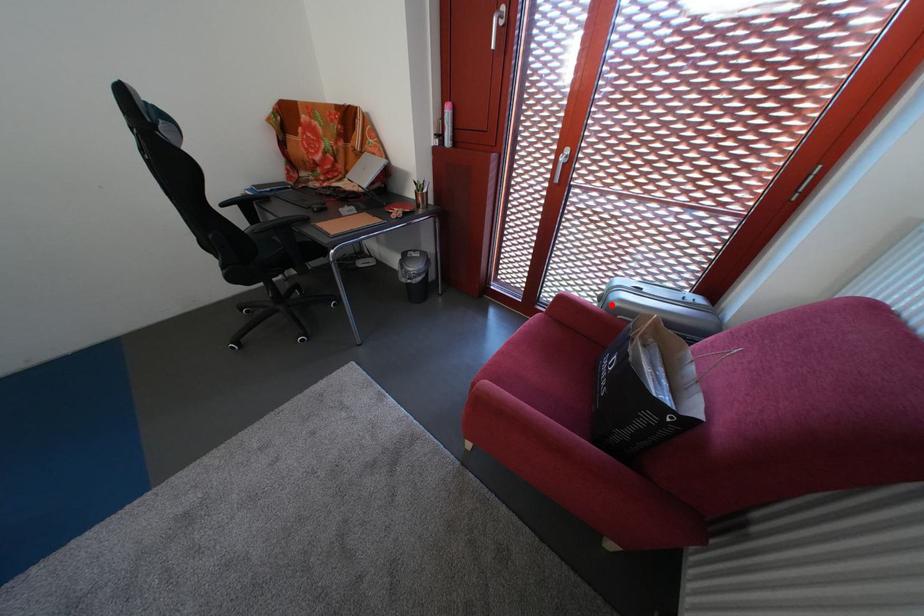
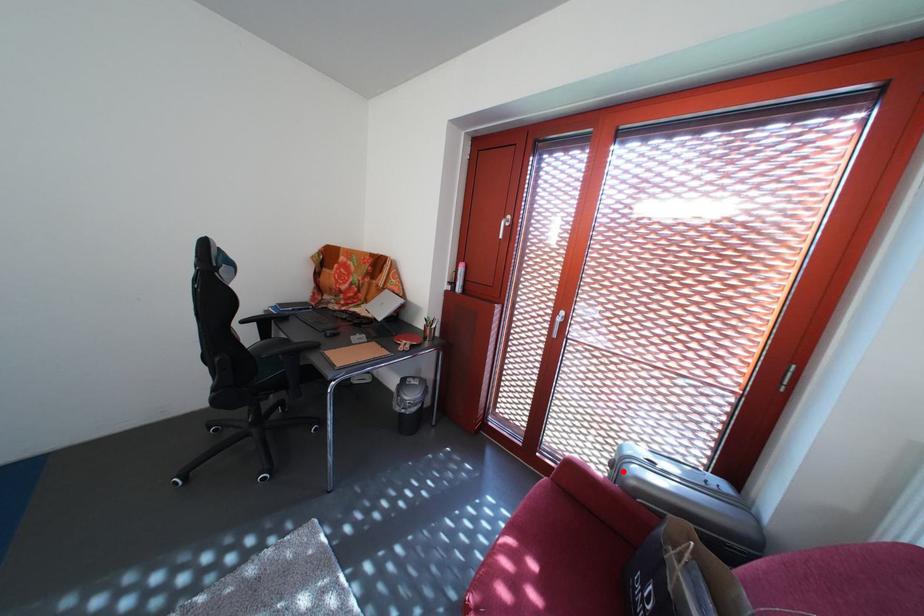
I am providing you with two images of the same scene from different viewpoints. A red point is marked on the first image and another point is marked on the second image. Do the highlighted points in image1 and image2 indicate the same real-world spot?

Yes